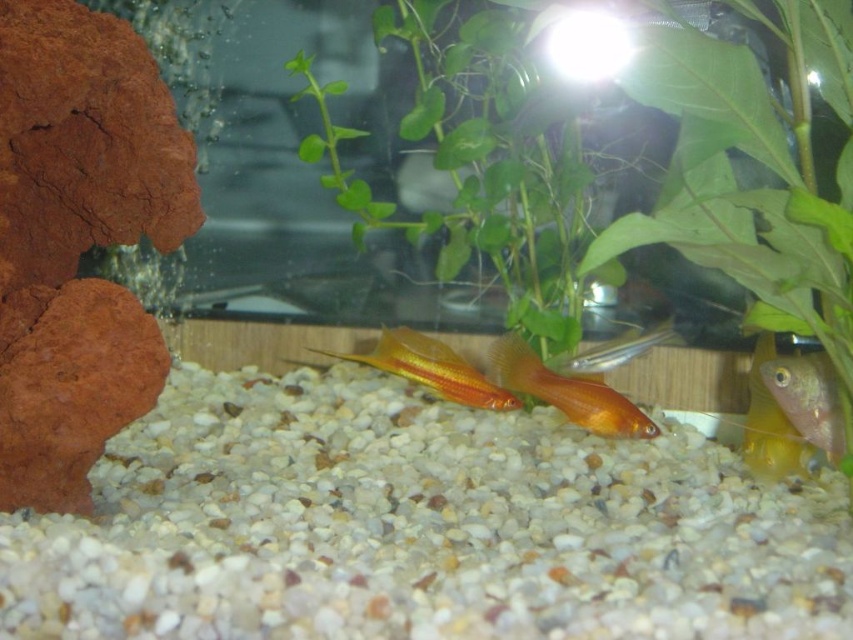
Question: Can you confirm if goldfish at center is smaller than shiny orange fish at center?

Choices:
 (A) no
 (B) yes

Answer: (A)

Question: From the image, what is the correct spatial relationship of green leafy plant at center in relation to goldfish at center?

Choices:
 (A) right
 (B) left

Answer: (B)

Question: Which point appears farthest from the camera in this image?

Choices:
 (A) (534, 417)
 (B) (445, 381)
 (C) (572, 355)
 (D) (469, 92)

Answer: (D)

Question: Can you confirm if green leafy plant at center is positioned to the left of translucent yellow fish at lower right?

Choices:
 (A) no
 (B) yes

Answer: (B)

Question: Which is nearer to the green leafy plant at center?

Choices:
 (A) shiny orange fish at center
 (B) shiny gold fish at center

Answer: (B)

Question: Which of the following is the closest to the observer?

Choices:
 (A) (643, 339)
 (B) (461, 92)

Answer: (A)